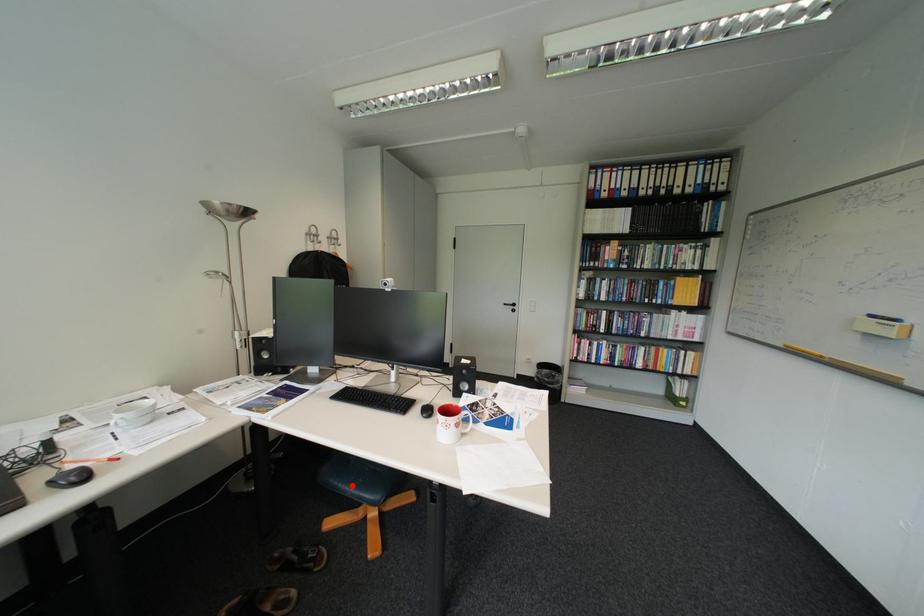
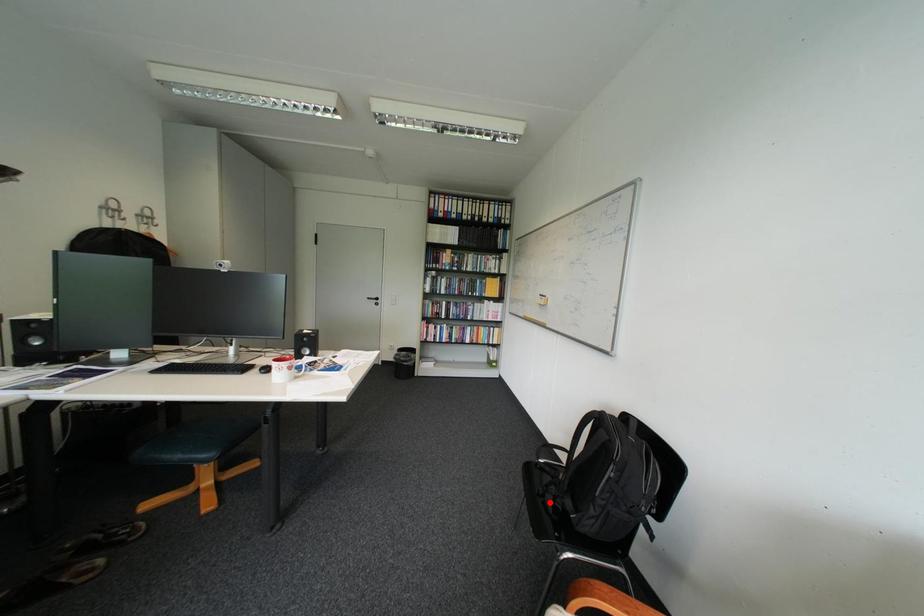
I am providing you with two images of the same scene from different viewpoints. A red point is marked on the first image and another point is marked on the second image. Does the point marked in image1 correspond to the same location as the one in image2?

No